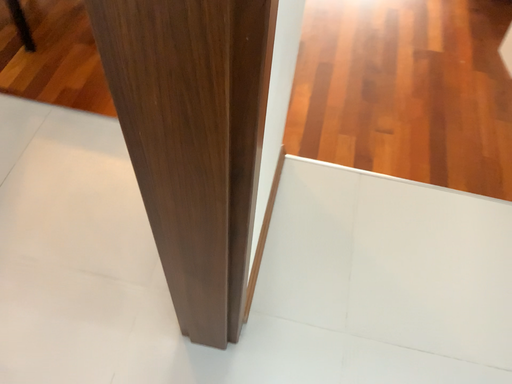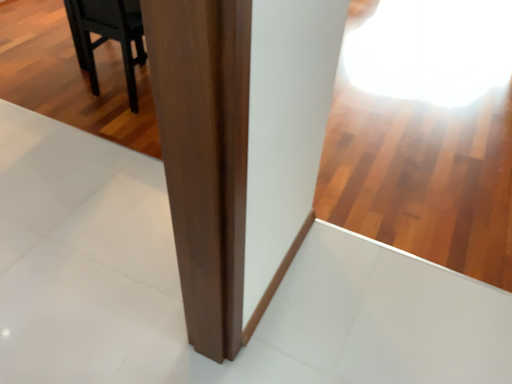
Question: How did the camera likely rotate when shooting the video?

Choices:
 (A) rotated left
 (B) rotated right

Answer: (A)